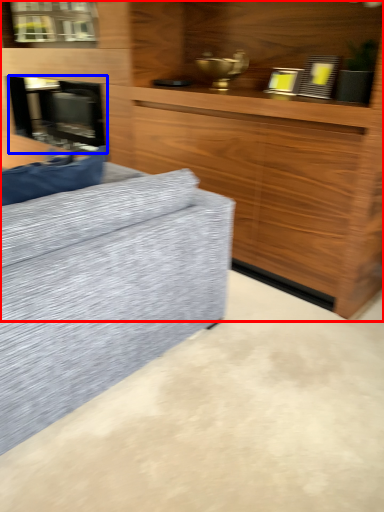
Question: Among these objects, which one is nearest to the camera, cabinetry (highlighted by a red box) or fireplace (highlighted by a blue box)?

Choices:
 (A) cabinetry
 (B) fireplace

Answer: (A)